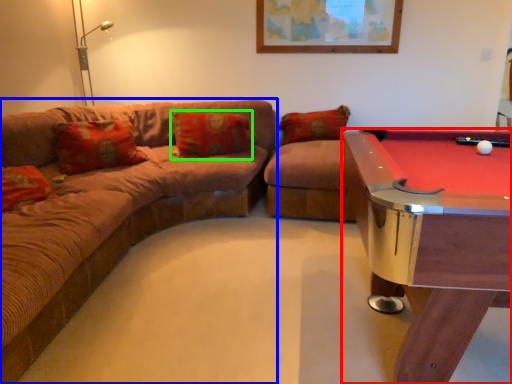
Question: Based on their relative distances, which object is nearer to billiard table (highlighted by a red box)? Choose from studio couch (highlighted by a blue box) and pillow (highlighted by a green box).

Choices:
 (A) studio couch
 (B) pillow

Answer: (A)